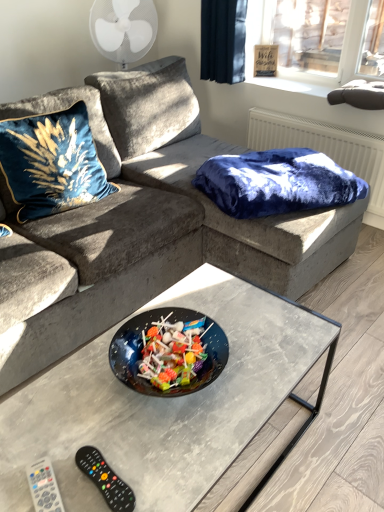
Question: From the image's perspective, is velvet blue blanket at upper right above velvet blue pillow at upper left?

Choices:
 (A) yes
 (B) no

Answer: (B)

Question: Is velvet blue blanket at upper right looking in the opposite direction of velvet blue pillow at upper left?

Choices:
 (A) no
 (B) yes

Answer: (A)

Question: Considering the relative positions of velvet blue blanket at upper right and velvet blue pillow at upper left in the image provided, is velvet blue blanket at upper right in front of velvet blue pillow at upper left?

Choices:
 (A) yes
 (B) no

Answer: (B)

Question: Is velvet blue blanket at upper right not within velvet blue pillow at upper left?

Choices:
 (A) yes
 (B) no

Answer: (A)

Question: From a real-world perspective, does velvet blue blanket at upper right stand above velvet blue pillow at upper left?

Choices:
 (A) no
 (B) yes

Answer: (A)

Question: Does point (117, 504) appear closer or farther from the camera than point (52, 161)?

Choices:
 (A) farther
 (B) closer

Answer: (B)

Question: Is black plastic remote at lower left, which ranks as the 2th remote in left-to-right order, in front of or behind velvet blue pillow at upper left in the image?

Choices:
 (A) behind
 (B) front

Answer: (B)

Question: Is black plastic remote at lower left, which ranks as the 2th remote in left-to-right order, spatially inside velvet blue pillow at upper left, or outside of it?

Choices:
 (A) inside
 (B) outside

Answer: (B)

Question: Considering the positions of black plastic remote at lower left, marked as the first remote in a right-to-left arrangement, and velvet blue pillow at upper left in the image, is black plastic remote at lower left, marked as the first remote in a right-to-left arrangement, taller or shorter than velvet blue pillow at upper left?

Choices:
 (A) short
 (B) tall

Answer: (A)

Question: Is velvet blue pillow at upper left inside or outside of velvet blue blanket at upper right?

Choices:
 (A) outside
 (B) inside

Answer: (A)

Question: In terms of width, does velvet blue pillow at upper left look wider or thinner when compared to velvet blue blanket at upper right?

Choices:
 (A) thin
 (B) wide

Answer: (A)

Question: Is point (38, 195) positioned closer to the camera than point (316, 159)?

Choices:
 (A) closer
 (B) farther

Answer: (A)

Question: From their relative heights in the image, would you say velvet blue pillow at upper left is taller or shorter than velvet blue blanket at upper right?

Choices:
 (A) short
 (B) tall

Answer: (B)

Question: From the image's perspective, is black plastic remote at lower left, which ranks as the 2th remote in left-to-right order, positioned above or below velvet blue blanket at upper right?

Choices:
 (A) below
 (B) above

Answer: (A)

Question: Is black plastic remote at lower left, marked as the first remote in a right-to-left arrangement, in front of or behind velvet blue blanket at upper right in the image?

Choices:
 (A) front
 (B) behind

Answer: (A)